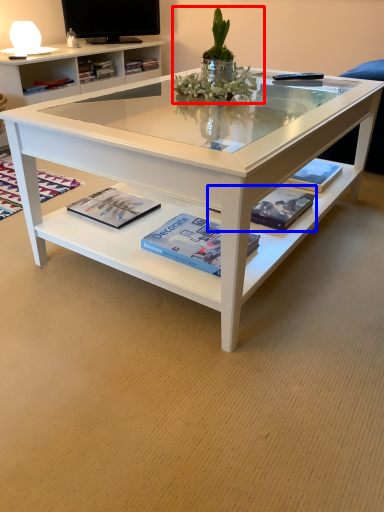
Question: Which object is further to the camera taking this photo, floral arrangement (highlighted by a red box) or magazine (highlighted by a blue box)?

Choices:
 (A) floral arrangement
 (B) magazine

Answer: (B)